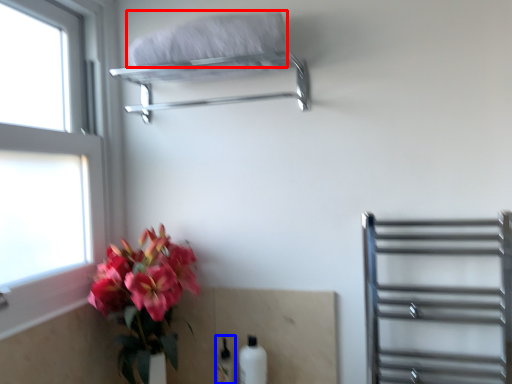
Question: Which of the following is the closest to the observer, bath towel (highlighted by a red box) or bottle (highlighted by a blue box)?

Choices:
 (A) bath towel
 (B) bottle

Answer: (A)